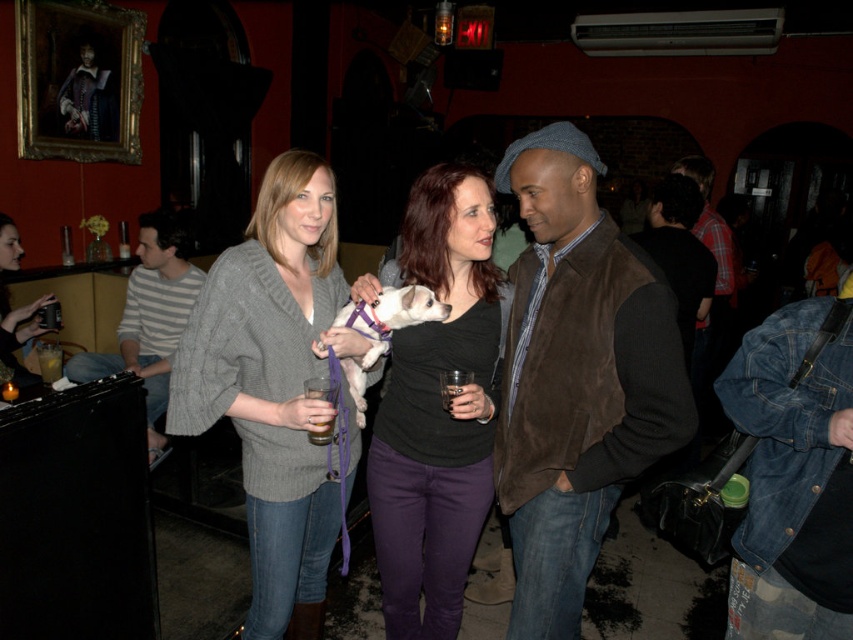
Does point (13, 227) come closer to viewer compared to point (445, 387)?

No.

Between matte gray sweater at left and translucent glass at center, which one is positioned lower?

translucent glass at center

Does point (3, 372) come in front of point (440, 392)?

No, (3, 372) is further to viewer.

Where is `matte gray sweater at left`? Image resolution: width=853 pixels, height=640 pixels. matte gray sweater at left is located at coordinates (16, 332).

What do you see at coordinates (436, 404) in the screenshot?
I see `black matte shirt at center` at bounding box center [436, 404].

Is black matte shirt at center smaller than translucent glass at bar left?

No, black matte shirt at center is not smaller than translucent glass at bar left.

Which is behind, point (473, 445) or point (38, 358)?

The point (38, 358) is more distant.

Identify the location of black matte shirt at center. (436, 404).

Who is lower down, knitted gray sweater at center or matte gray sweater at left?

Positioned lower is knitted gray sweater at center.

Can you confirm if knitted gray sweater at center is positioned to the left of matte gray sweater at left?

No, knitted gray sweater at center is not to the left of matte gray sweater at left.

Image resolution: width=853 pixels, height=640 pixels. What do you see at coordinates (274, 385) in the screenshot? I see `knitted gray sweater at center` at bounding box center [274, 385].

You are a GUI agent. You are given a task and a screenshot of the screen. Output one action in this format:
    pyautogui.click(x=<x>, y=<y>)
    Task: Click on the knitted gray sweater at center
    
    Given the screenshot: What is the action you would take?
    pyautogui.click(x=274, y=385)